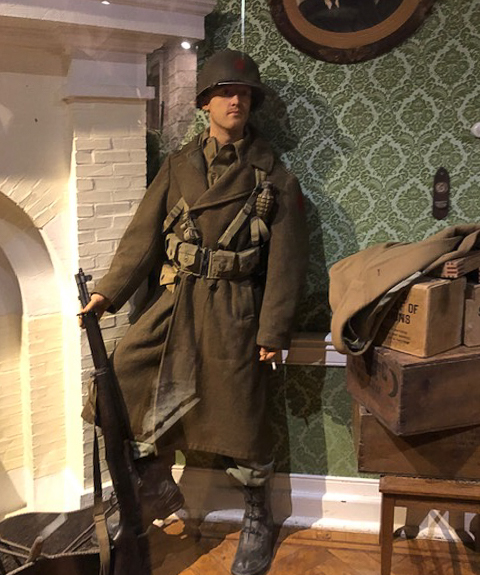
Find the location of a particular element. Image resolution: width=480 pixels, height=575 pixels. coat is located at coordinates (204, 344).